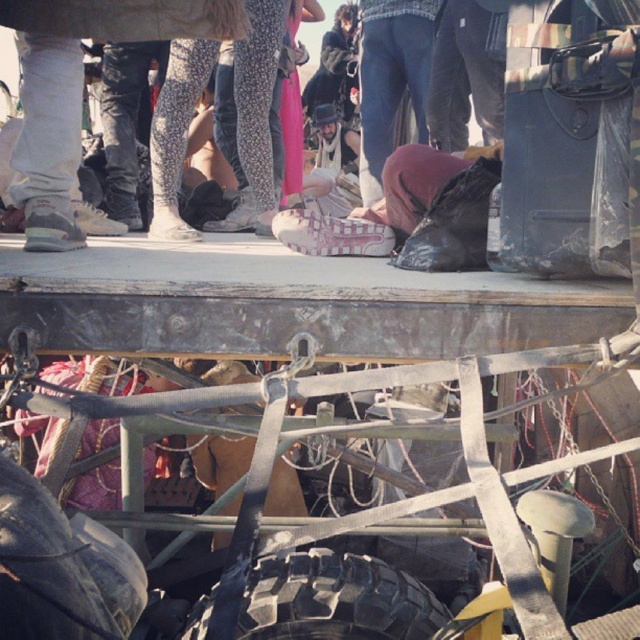
Question: Which point is farther to the camera?

Choices:
 (A) black rubber tire at bottom
 (B) black rubber tire at lower left

Answer: (A)

Question: Can you confirm if black rubber tire at lower left is positioned below black rubber tire at bottom?

Choices:
 (A) no
 (B) yes

Answer: (A)

Question: Which of the following is the closest to the observer?

Choices:
 (A) (243, 636)
 (B) (12, 556)

Answer: (B)

Question: Is black rubber tire at lower left below black rubber tire at bottom?

Choices:
 (A) yes
 (B) no

Answer: (B)

Question: Can you confirm if black rubber tire at lower left is smaller than black rubber tire at bottom?

Choices:
 (A) no
 (B) yes

Answer: (B)